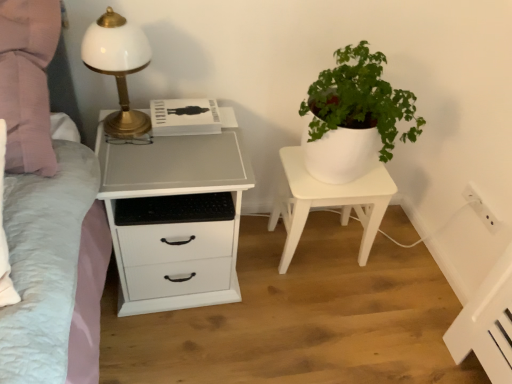
Where is `vacant space that's between white matte chest of drawers at left and white matte plant pot at center`? vacant space that's between white matte chest of drawers at left and white matte plant pot at center is located at coordinates (270, 264).